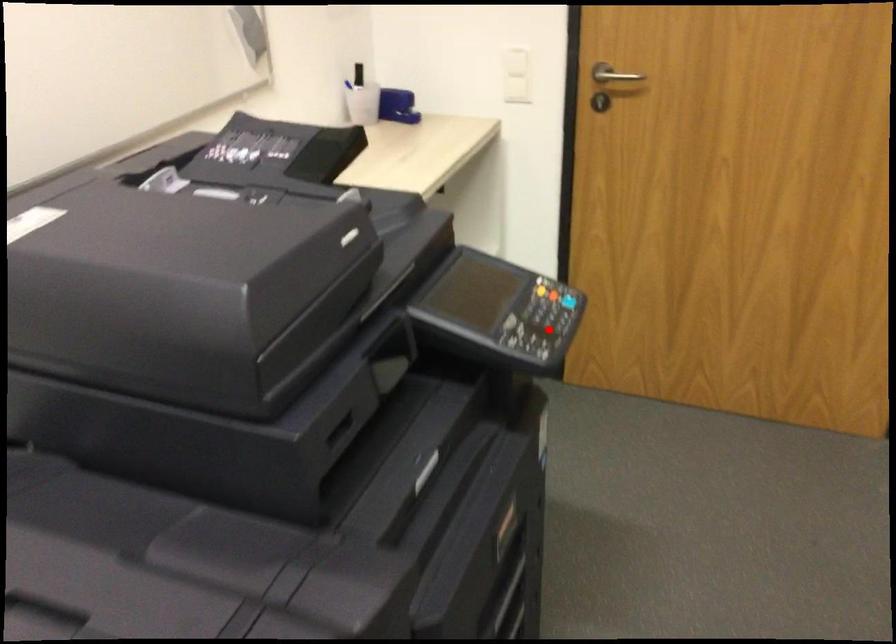
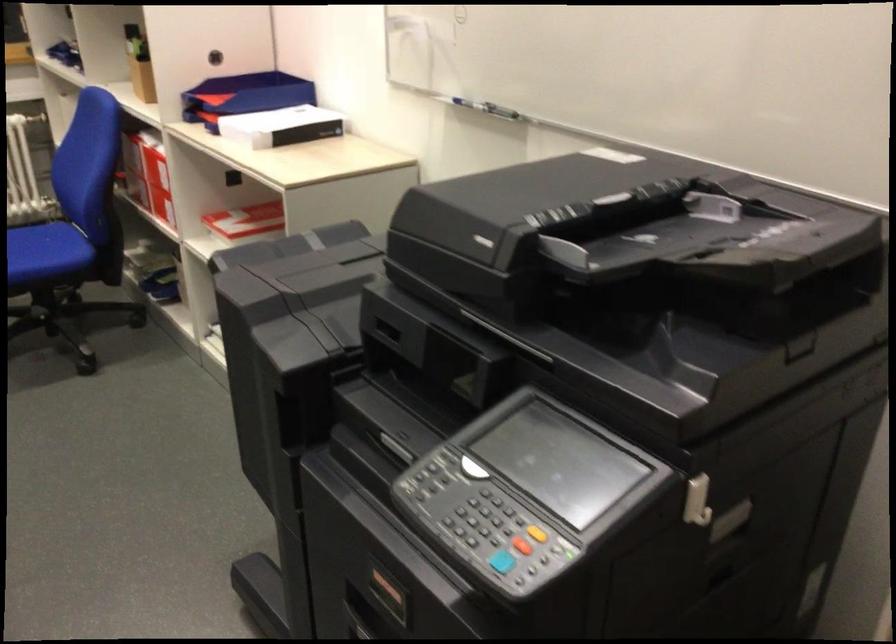
Question: I am providing you with two images of the same scene from different viewpoints. In image1, a red point is highlighted. Considering the same 3D point in image2, which of the following is correct?

Choices:
 (A) It is closer
 (B) It is farther

Answer: (A)